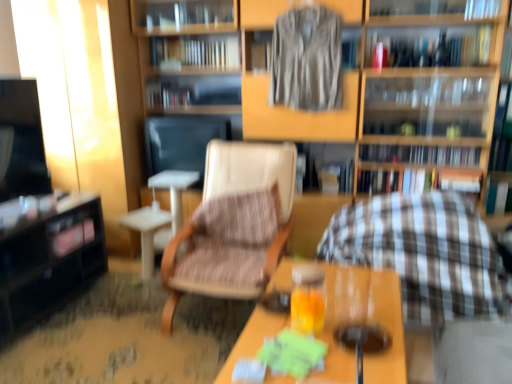
Question: Is the position of wooden bookshelf at center less distant than that of silky brown shirt at upper center?

Choices:
 (A) no
 (B) yes

Answer: (B)

Question: From a real-world perspective, is wooden bookshelf at center positioned over silky brown shirt at upper center based on gravity?

Choices:
 (A) yes
 (B) no

Answer: (B)

Question: Is wooden bookshelf at center with silky brown shirt at upper center?

Choices:
 (A) no
 (B) yes

Answer: (A)

Question: Is wooden bookshelf at center positioned behind silky brown shirt at upper center?

Choices:
 (A) yes
 (B) no

Answer: (B)

Question: Considering the relative sizes of wooden bookshelf at center and silky brown shirt at upper center in the image provided, is wooden bookshelf at center wider than silky brown shirt at upper center?

Choices:
 (A) yes
 (B) no

Answer: (A)

Question: From a real-world perspective, is wooden bookshelf at center under silky brown shirt at upper center?

Choices:
 (A) yes
 (B) no

Answer: (A)

Question: Can you confirm if translucent glass beverage at center is thinner than hardcover book at center, the 3th book ordered from the bottom?

Choices:
 (A) yes
 (B) no

Answer: (B)

Question: Could you tell me if translucent glass beverage at center is turned towards hardcover book at center, acting as the fourth book starting from the top?

Choices:
 (A) yes
 (B) no

Answer: (B)

Question: From the image's perspective, is translucent glass beverage at center located beneath hardcover book at center, acting as the fourth book starting from the top?

Choices:
 (A) no
 (B) yes

Answer: (B)

Question: Is translucent glass beverage at center far away from hardcover book at center, the 3th book ordered from the bottom?

Choices:
 (A) yes
 (B) no

Answer: (A)

Question: Can you confirm if translucent glass beverage at center is bigger than hardcover book at center, the 3th book ordered from the bottom?

Choices:
 (A) no
 (B) yes

Answer: (A)

Question: From the image's perspective, is translucent glass beverage at center above hardcover book at center, the 3th book ordered from the bottom?

Choices:
 (A) no
 (B) yes

Answer: (A)

Question: Could you tell me if translucent glass beverage at center is facing hardcover books at upper center, acting as the 2th book starting from the bottom?

Choices:
 (A) no
 (B) yes

Answer: (A)